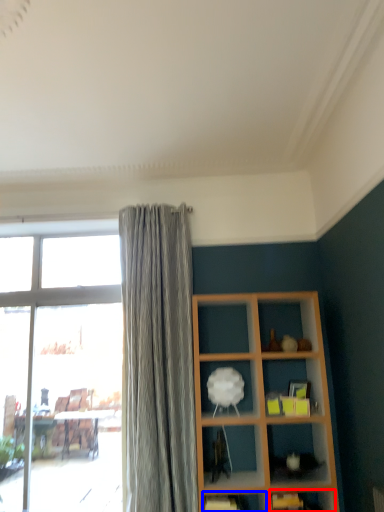
Question: Among these objects, which one is farthest to the camera, shelf (highlighted by a red box) or shelf (highlighted by a blue box)?

Choices:
 (A) shelf
 (B) shelf

Answer: (B)